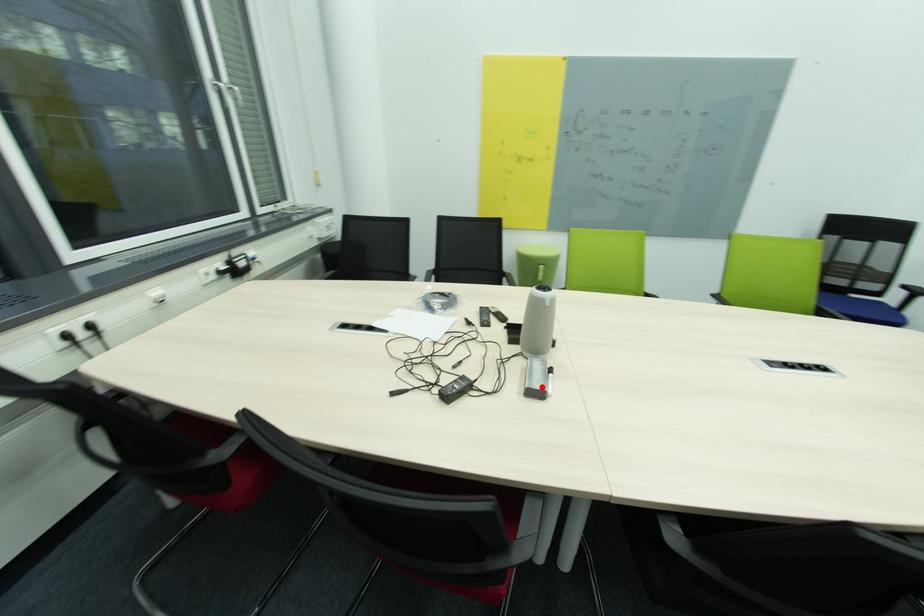
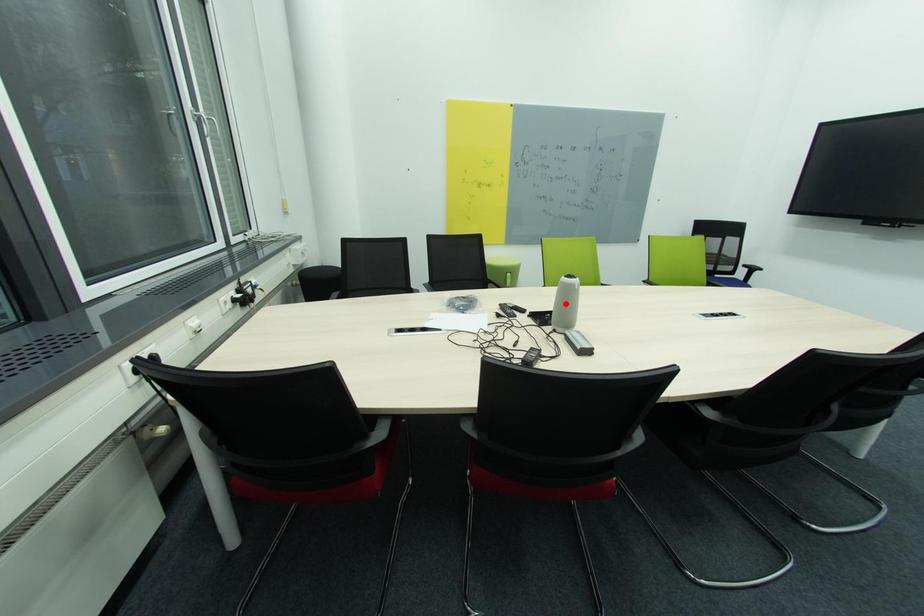
Based on the photo, I am providing you with two images of the same scene from different viewpoints. A red point is marked on the first image and another point is marked on the second image. Are the points marked in image1 and image2 representing the same 3D position?

No